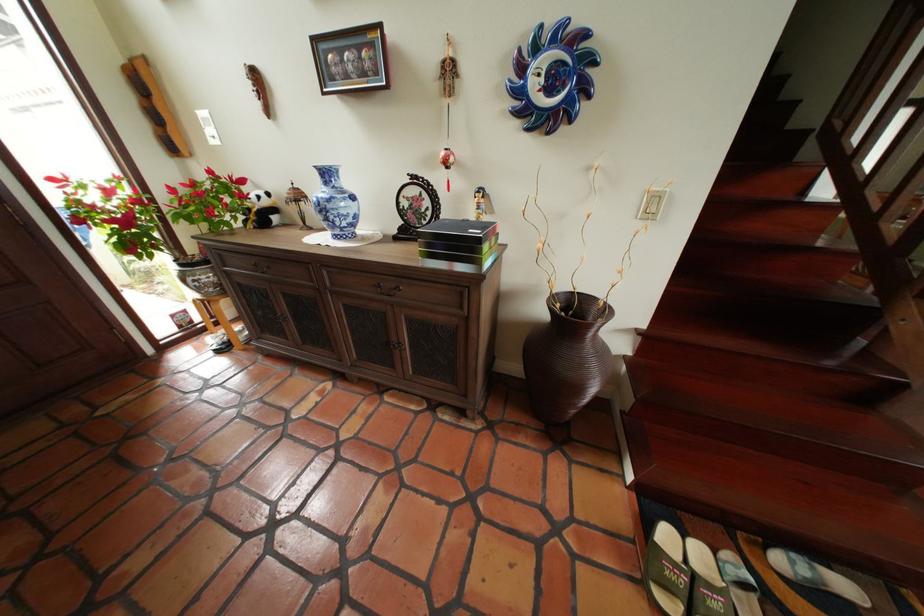
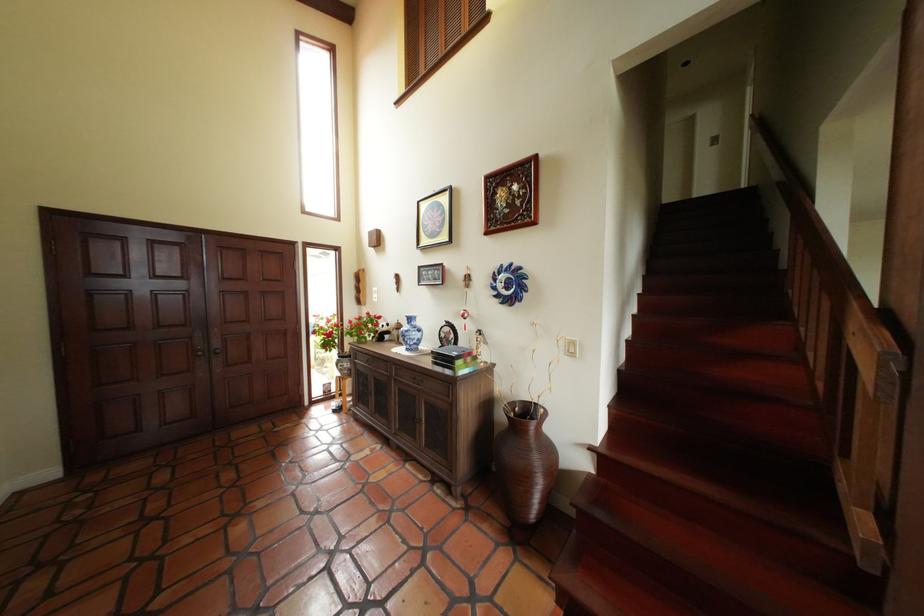
Find the pixel in the second image that matches the point at 261,205 in the first image.

(390, 330)